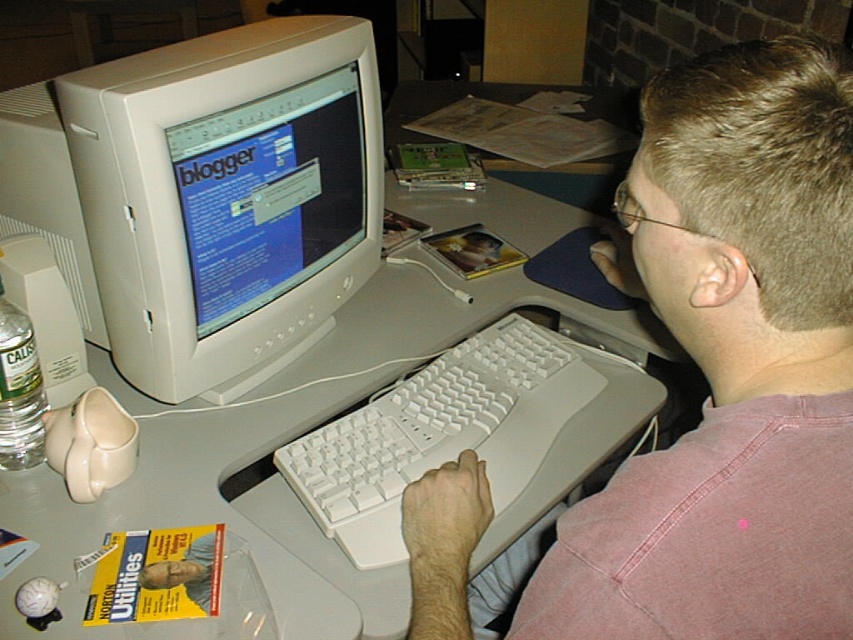
Can you confirm if white plastic monitor at upper left is bigger than matte white monitor at center?

Yes, white plastic monitor at upper left is bigger than matte white monitor at center.

Which is in front, point (192, 96) or point (323, 80)?

Point (192, 96) is more forward.

Between point (148, 113) and point (363, 205), which one is positioned in front?

Point (148, 113) is more forward.

You are a GUI agent. You are given a task and a screenshot of the screen. Output one action in this format:
    pyautogui.click(x=<x>, y=<y>)
    Task: Click on the white plastic monitor at upper left
    
    Given the screenshot: What is the action you would take?
    pyautogui.click(x=227, y=196)

Does white plastic monitor at upper left come behind white plastic computer desk at center?

Yes.

Between point (120, 180) and point (331, 358), which one is positioned behind?

The point (331, 358) is more distant.

Does point (152, 272) come farther from viewer compared to point (605, 189)?

That is False.

Where is `white plastic monitor at upper left`? The width and height of the screenshot is (853, 640). white plastic monitor at upper left is located at coordinates pyautogui.click(x=227, y=196).

Can you confirm if white plastic computer desk at center is wider than white plastic keyboard at center?

Yes.

Does white plastic computer desk at center appear on the right side of white plastic keyboard at center?

No, white plastic computer desk at center is not to the right of white plastic keyboard at center.

This screenshot has width=853, height=640. I want to click on white plastic computer desk at center, so click(300, 433).

Find the location of a particular element. This screenshot has width=853, height=640. white plastic computer desk at center is located at coordinates (300, 433).